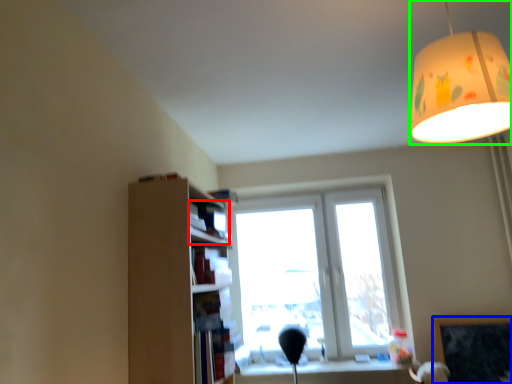
Question: Which is nearer to the book (highlighted by a red box)? bulletin board (highlighted by a blue box) or lamp (highlighted by a green box).

Choices:
 (A) bulletin board
 (B) lamp

Answer: (B)